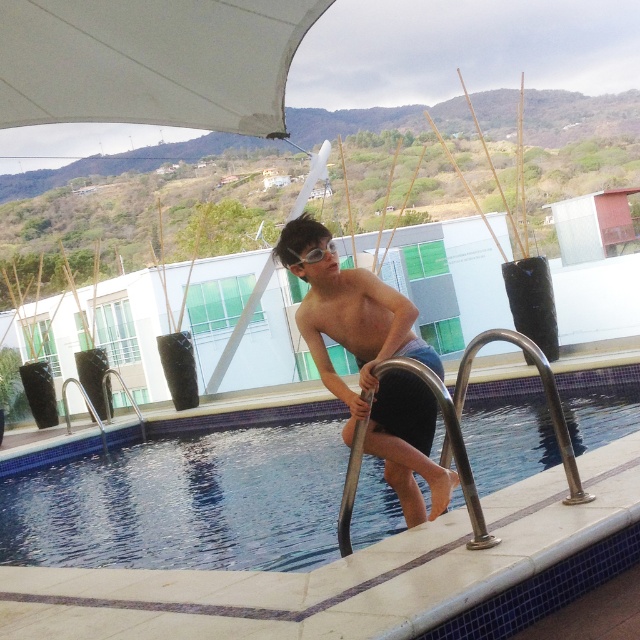
Is point (224, 481) positioned before point (321, 257)?

No, it is behind (321, 257).

Who is taller, blue glossy water at center or clear plastic goggles at upper center?

With more height is blue glossy water at center.

Between point (132, 477) and point (291, 253), which one is positioned in front?

Positioned in front is point (291, 253).

At what (x,y) coordinates should I click in order to perform the action: click on blue glossy water at center. Please return your answer as a coordinate pair (x, y). The height and width of the screenshot is (640, 640). Looking at the image, I should click on click(184, 502).

Is point (374, 348) positioned in front of point (307, 259)?

That is False.

Between light blue denim shorts at center and clear plastic goggles at upper center, which one has less height?

With less height is clear plastic goggles at upper center.

Locate an element on the screen. The height and width of the screenshot is (640, 640). light blue denim shorts at center is located at coordinates (371, 364).

Can you confirm if blue glossy water at center is positioned to the right of light blue denim shorts at center?

Yes, blue glossy water at center is to the right of light blue denim shorts at center.

Can you confirm if blue glossy water at center is bigger than light blue denim shorts at center?

No.

What are the coordinates of `blue glossy water at center` in the screenshot? It's located at (184, 502).

I want to click on blue glossy water at center, so click(x=184, y=502).